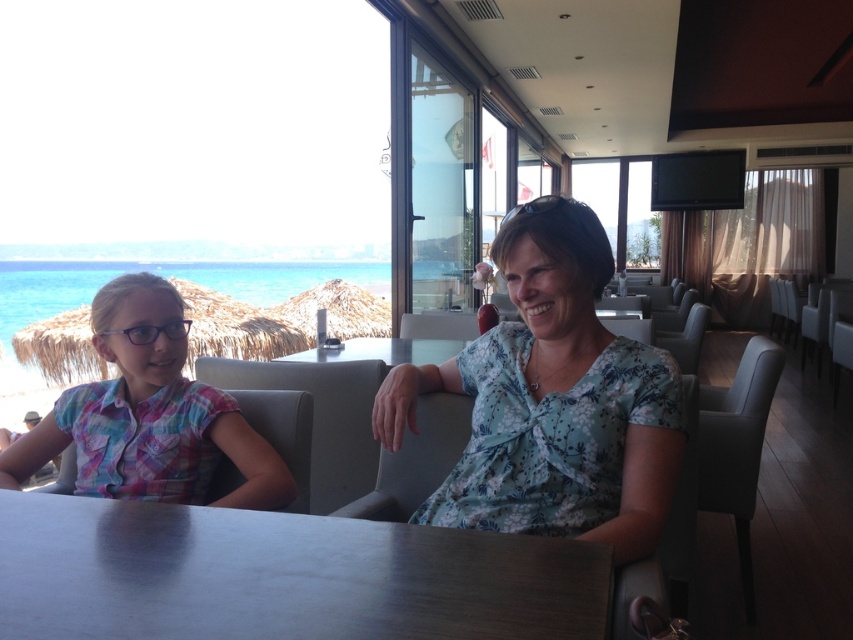
Between multicolored plaid shirt at left and black plastic goggles at upper center, which one has less height?

black plastic goggles at upper center is shorter.

Is point (114, 330) more distant than point (556, 198)?

Yes, point (114, 330) is farther from viewer.

Is point (282, 492) positioned behind point (519, 209)?

That is True.

Image resolution: width=853 pixels, height=640 pixels. In order to click on multicolored plaid shirt at left in this screenshot , I will do `click(149, 413)`.

Where is `smooth wooden table at center`? smooth wooden table at center is located at coordinates (281, 577).

Does point (418, 552) lie behind point (32, 449)?

No, it is not.

Is point (465, 627) positioned after point (103, 444)?

No, (465, 627) is closer to viewer.

The width and height of the screenshot is (853, 640). Find the location of `smooth wooden table at center`. smooth wooden table at center is located at coordinates (281, 577).

Does smooth wooden table at center have a greater height compared to smooth glass table at center?

No.

This screenshot has height=640, width=853. Find the location of `smooth wooden table at center`. smooth wooden table at center is located at coordinates (281, 577).